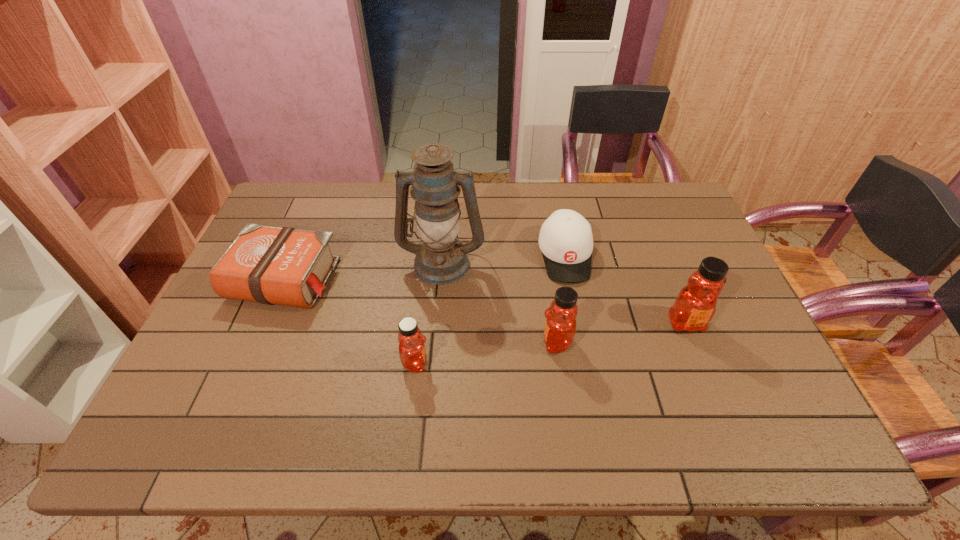
Please point a spot to add another honey on the left. Please provide its 2D coordinates. Your answer should be formatted as a tuple, i.e. [(x, y)], where the tuple contains the x and y coordinates of a point satisfying the conditions above.

[(264, 384)]